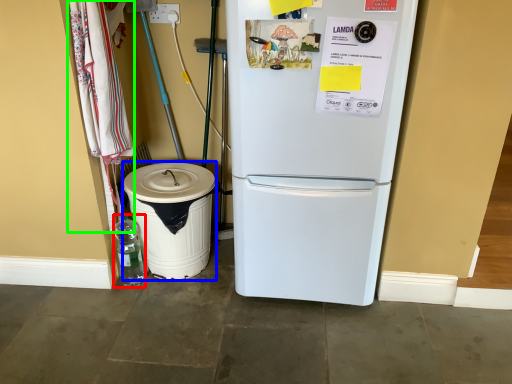
Question: Which is farther away from bottle (highlighted by a red box)? trash bin/can (highlighted by a blue box) or laundry (highlighted by a green box)?

Choices:
 (A) trash bin/can
 (B) laundry

Answer: (B)